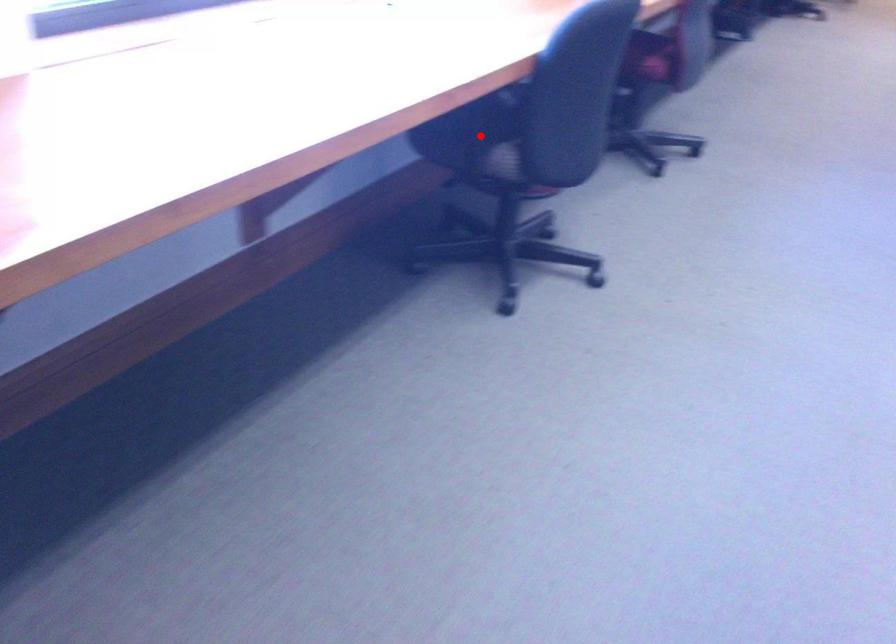
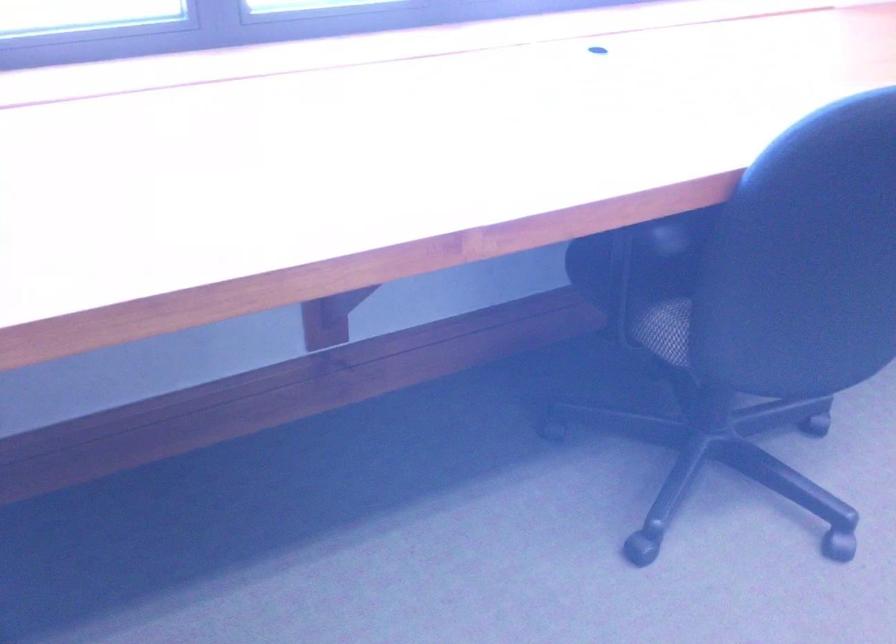
Question: A red point is marked in image1. In image2, is the corresponding 3D point closer to the camera or farther? Reply with the corresponding letter.

Choices:
 (A) The corresponding 3D point is closer.
 (B) The corresponding 3D point is farther.

Answer: (A)